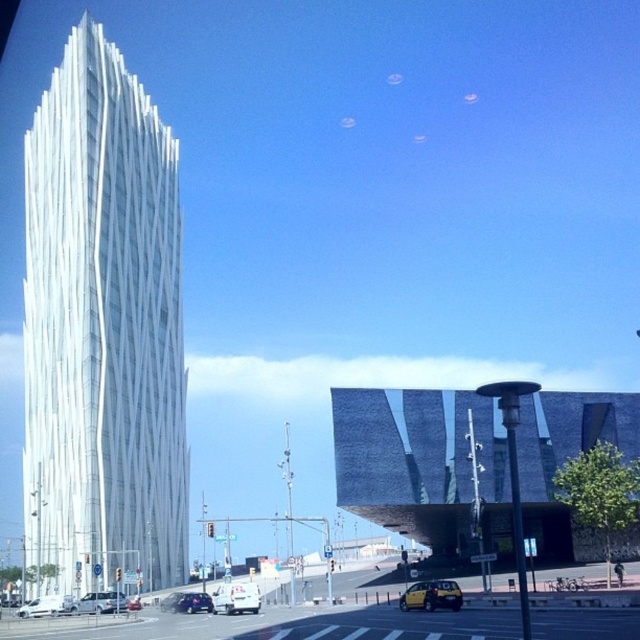
Between white matte van at lower left and metallic silver sedan at center, which one has more height?

metallic silver sedan at center

Which is above, white matte van at lower left or metallic silver sedan at center?

Positioned higher is metallic silver sedan at center.

Measure the distance between point (60, 609) and camera.

Point (60, 609) is 76.75 meters away from camera.

I want to click on white matte van at lower left, so click(x=44, y=605).

Does white matte van at center have a larger size compared to white matte van at lower left?

Yes, white matte van at center is bigger than white matte van at lower left.

Can you confirm if white matte van at center is positioned below white matte van at lower left?

No.

Image resolution: width=640 pixels, height=640 pixels. What do you see at coordinates (236, 596) in the screenshot?
I see `white matte van at center` at bounding box center [236, 596].

The width and height of the screenshot is (640, 640). I want to click on white matte van at center, so click(x=236, y=596).

Which is behind, point (218, 600) or point (179, 609)?

The point (179, 609) is behind.

Is point (248, 592) closer to viewer compared to point (211, 602)?

That is True.

The width and height of the screenshot is (640, 640). Find the location of `white matte van at center`. white matte van at center is located at coordinates (236, 596).